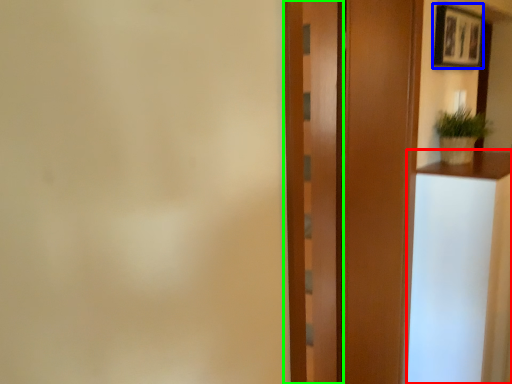
Question: Estimate the real-world distances between objects in this image. Which object is farther from vanity (highlighted by a red box), picture frame (highlighted by a blue box) or barn door (highlighted by a green box)?

Choices:
 (A) picture frame
 (B) barn door

Answer: (A)